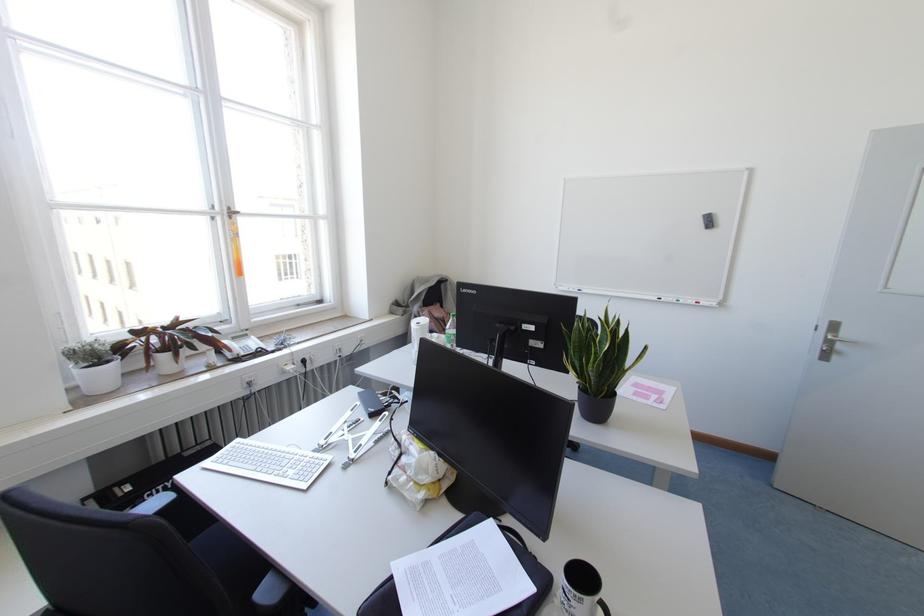
Where would you lift the potted snake plant? Please return your answer as a coordinate pair (x, y).

(598, 362)